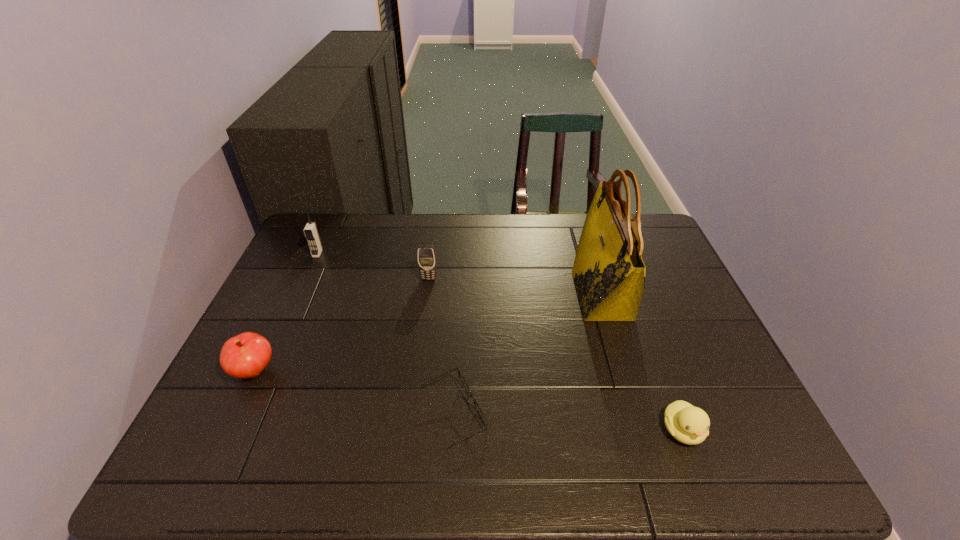
This screenshot has width=960, height=540. In order to click on cellular telephone present at the left edge in this screenshot , I will do `click(311, 233)`.

Locate an element on the screen. apple situated at the left edge is located at coordinates (246, 355).

Where is `object present at the right edge`? The width and height of the screenshot is (960, 540). object present at the right edge is located at coordinates (690, 425).

Locate an element on the screen. object that is at the far left corner is located at coordinates (311, 233).

What are the coordinates of `object that is at the near right corner` in the screenshot? It's located at (690, 425).

Where is `vacant point at the far edge`? Image resolution: width=960 pixels, height=540 pixels. vacant point at the far edge is located at coordinates (517, 221).

In the image, there is a desktop. Where is `blank space at the near edge`? This screenshot has width=960, height=540. blank space at the near edge is located at coordinates (585, 474).

The width and height of the screenshot is (960, 540). What are the coordinates of `vacant region at the left edge` in the screenshot? It's located at (252, 409).

This screenshot has width=960, height=540. What are the coordinates of `vacant space at the right edge of the desktop` in the screenshot? It's located at (677, 276).

Identify the location of free space at the far left corner. The width and height of the screenshot is (960, 540). (339, 230).